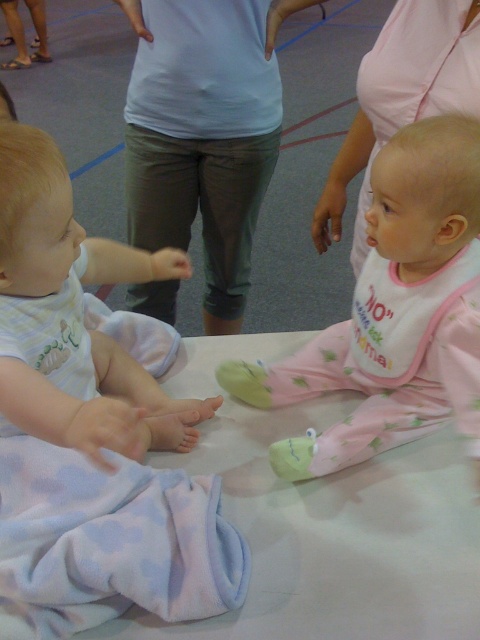
Question: Estimate the real-world distances between objects in this image. Which object is farther from the light blue fabric pants at center?

Choices:
 (A) light blue fleece blanket at lower left
 (B) pink cotton onesie at center
 (C) white soft baby at center
 (D) pink fabric dress at upper center

Answer: (A)

Question: Which object is positioned farthest from the pink fabric dress at upper center?

Choices:
 (A) pink cotton onesie at center
 (B) light blue fleece blanket at lower left

Answer: (B)

Question: Considering the relative positions of pink cotton onesie at center and white soft baby at center in the image provided, where is pink cotton onesie at center located with respect to white soft baby at center?

Choices:
 (A) left
 (B) right

Answer: (B)

Question: Does pink fabric dress at upper center appear under white fabric bib at center?

Choices:
 (A) yes
 (B) no

Answer: (B)

Question: Which of these objects is positioned farthest from the light blue fleece blanket at lower left?

Choices:
 (A) white soft baby at center
 (B) light blue fabric pants at center
 (C) pink cotton onesie at center

Answer: (B)

Question: Is light blue fleece blanket at lower left smaller than pink fabric dress at upper center?

Choices:
 (A) yes
 (B) no

Answer: (A)